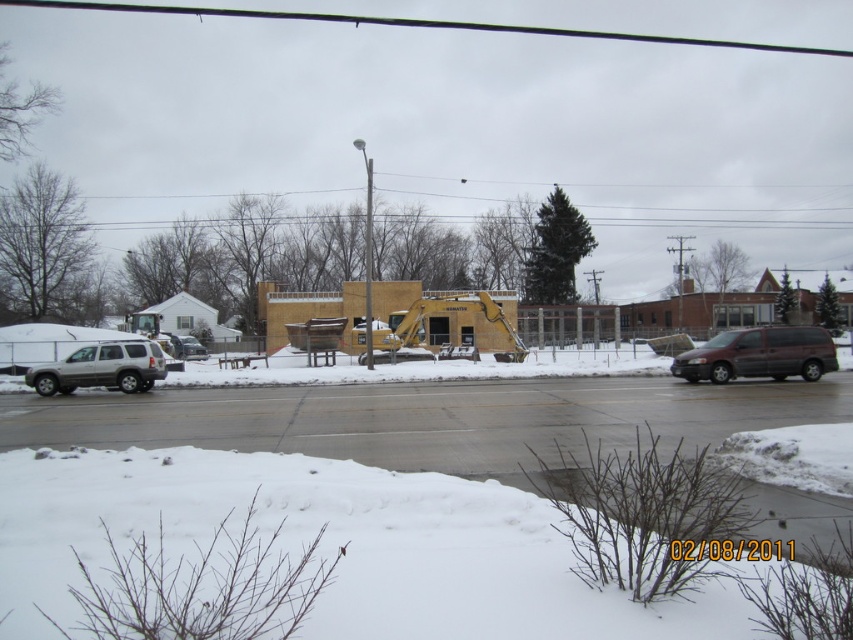
Question: Is dark gray matte van at right in front of silver metallic suv at left?

Choices:
 (A) yes
 (B) no

Answer: (A)

Question: Considering the real-world distances, which object is closest to the silver metallic suv at left?

Choices:
 (A) dark gray matte van at right
 (B) white fluffy snow at lower center

Answer: (B)

Question: Which of the following is the farthest from the observer?

Choices:
 (A) (78, 371)
 (B) (616, 614)

Answer: (A)

Question: Is white fluffy snow at lower center to the left of dark gray matte van at right from the viewer's perspective?

Choices:
 (A) no
 (B) yes

Answer: (B)

Question: Which object is the farthest from the dark gray matte van at right?

Choices:
 (A) white fluffy snow at lower center
 (B) silver metallic suv at left

Answer: (A)

Question: Considering the relative positions of white fluffy snow at lower center and silver metallic suv at left in the image provided, where is white fluffy snow at lower center located with respect to silver metallic suv at left?

Choices:
 (A) left
 (B) right

Answer: (B)